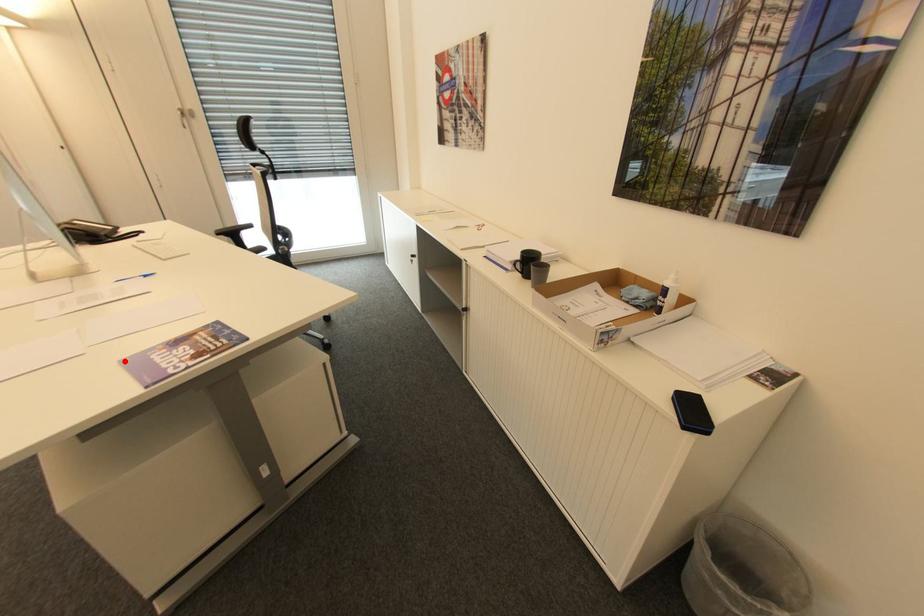
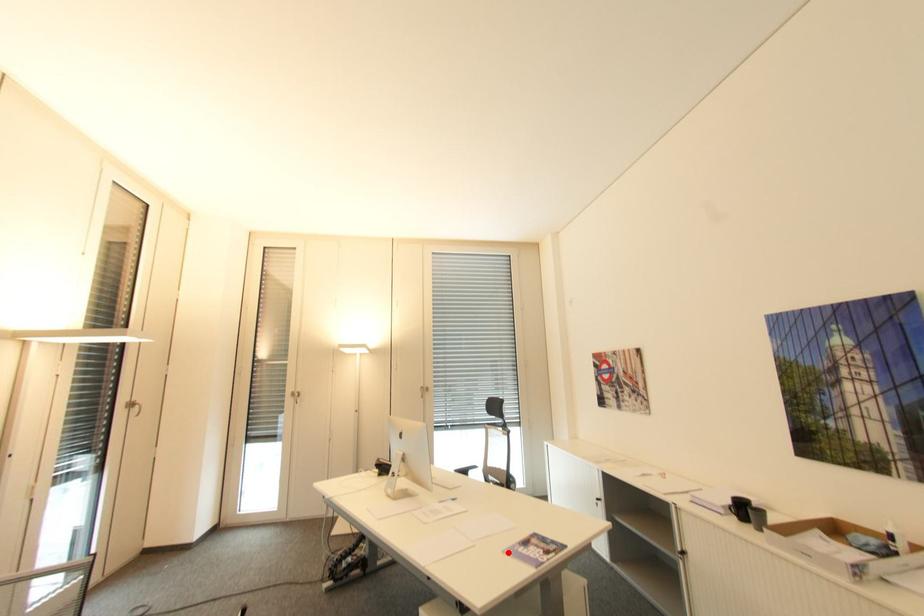
I am providing you with two images of the same scene from different viewpoints. A red point is marked on the first image and another point is marked on the second image. Does the point marked in image1 correspond to the same location as the one in image2?

Yes